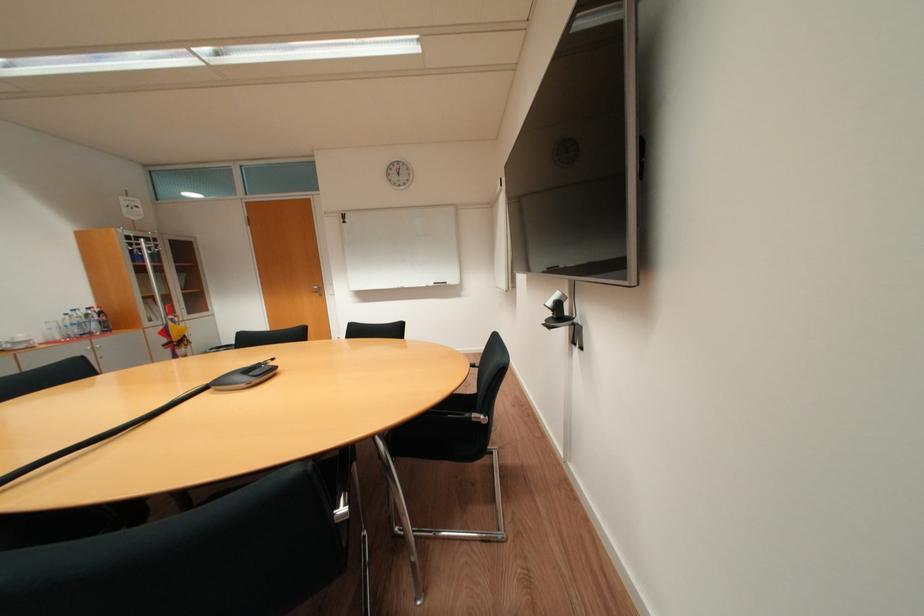
Identify the location of whiteboard eraser. This screenshot has width=924, height=616. (439, 283).